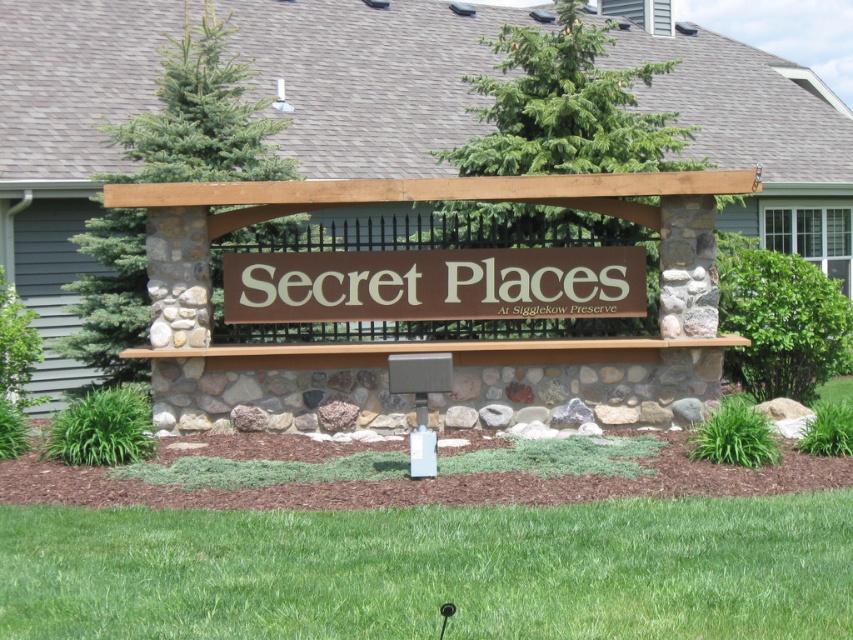
Is brown wood pergola at center below brown matte sign at center?

Actually, brown wood pergola at center is above brown matte sign at center.

Is brown wood pergola at center above brown matte sign at center?

Indeed, brown wood pergola at center is positioned over brown matte sign at center.

What do you see at coordinates (369, 77) in the screenshot? I see `brown wood pergola at center` at bounding box center [369, 77].

Where is `brown wood pergola at center`? The image size is (853, 640). brown wood pergola at center is located at coordinates (369, 77).